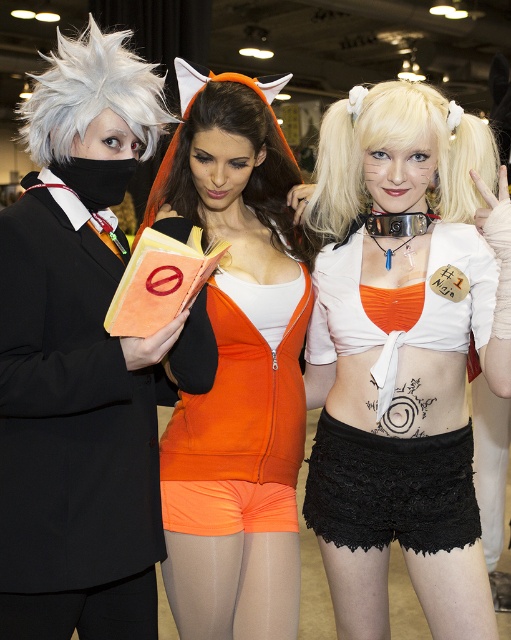
Question: Among these objects, which one is farthest from the camera?

Choices:
 (A) black lace shorts at lower center
 (B) blonde synthetic wig at center
 (C) orange fabric top at center

Answer: (A)

Question: Does black lace shorts at lower center have a greater width compared to blonde synthetic wig at center?

Choices:
 (A) yes
 (B) no

Answer: (B)

Question: Which point is closer to the camera taking this photo?

Choices:
 (A) (246, 522)
 (B) (235, 100)
 (C) (229, 364)

Answer: (B)

Question: Does white matte/soft fabric top at center appear under black lace shorts at lower center?

Choices:
 (A) no
 (B) yes

Answer: (A)

Question: Can you confirm if white matte/soft fabric top at center is thinner than white spiky wig at upper left?

Choices:
 (A) no
 (B) yes

Answer: (A)

Question: Which object is farther from the camera taking this photo?

Choices:
 (A) neon orange tights at center
 (B) orange fabric wig at center
 (C) orange fabric top at center
 (D) white matte/soft fabric top at center

Answer: (A)